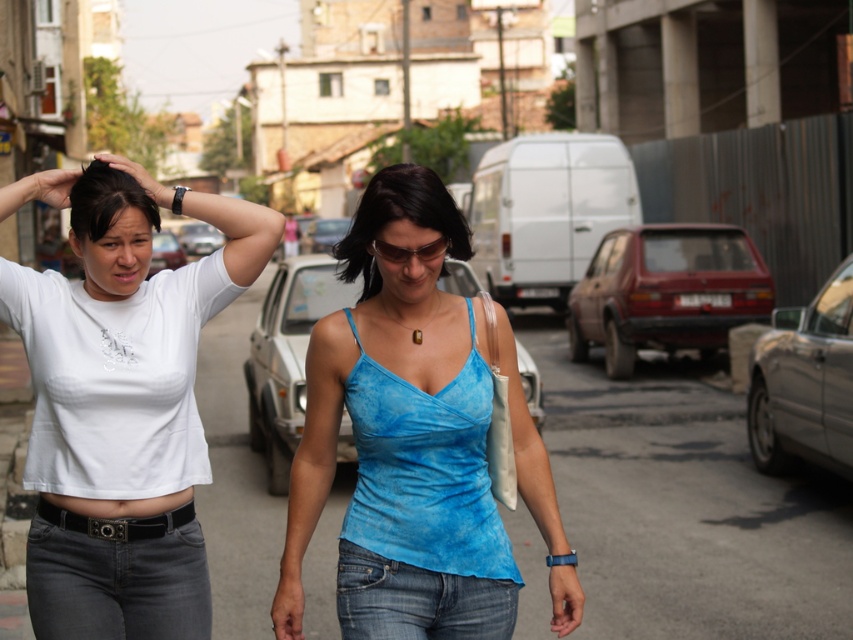
Does dark brown shiny hair at upper left appear under matte black watch at upper center?

Correct, dark brown shiny hair at upper left is located below matte black watch at upper center.

Is point (90, 164) positioned in front of point (144, 180)?

No, it is not.

Where is `dark brown shiny hair at upper left`? The height and width of the screenshot is (640, 853). dark brown shiny hair at upper left is located at coordinates (106, 200).

Which is behind, point (375, 179) or point (49, 204)?

The point (49, 204) is behind.

Is the position of dark brown hair at center more distant than that of matte black hand at upper left?

No, it is not.

Is point (364, 200) positioned before point (56, 170)?

Yes, it is.

Locate an element on the screen. The width and height of the screenshot is (853, 640). dark brown hair at center is located at coordinates (399, 218).

Between denim jeans at lower left and matte black hand at upper left, which one appears on the right side from the viewer's perspective?

denim jeans at lower left is more to the right.

Who is more forward, (91,570) or (51,179)?

Positioned in front is point (91,570).

The image size is (853, 640). Find the location of `denim jeans at lower left`. denim jeans at lower left is located at coordinates (90, 586).

Locate an element on the screen. denim jeans at lower left is located at coordinates (90, 586).